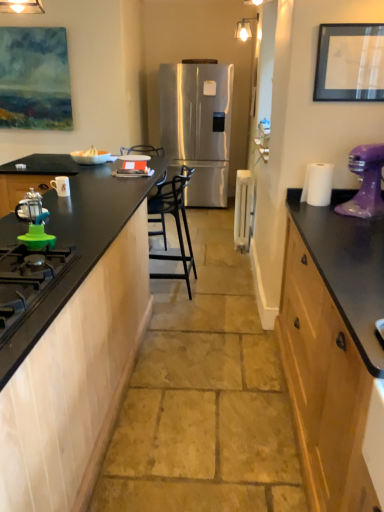
The image size is (384, 512). In order to click on vacant space to the left of white plastic radiator at center, the 5th appliance from the front in this screenshot , I will do click(x=216, y=247).